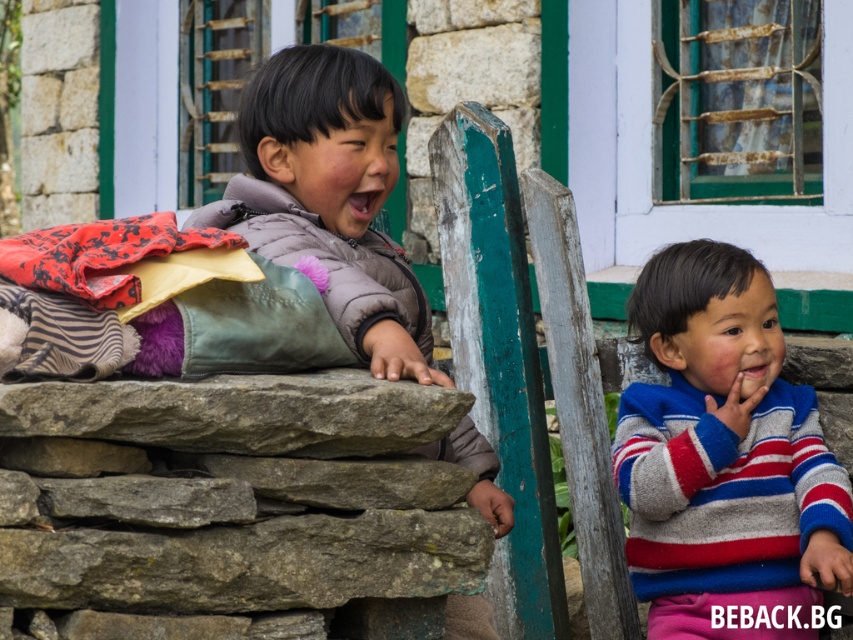
You are a photographer trying to capture a symmetrical composition. You notice the striped wool sweater at right and the matte gray jacket at center. Which object should you move to the left to balance the image?

To balance the image, you should move the striped wool sweater at right to the left side of the matte gray jacket at center, as it is currently positioned on the right side of it.

You are a photographer trying to capture both the striped wool sweater at right and the matte gray jacket at center in a single frame. Based on their positions, which object should you focus on first to ensure both are in focus?

The striped wool sweater at right is in front of the matte gray jacket at center, so you should focus on the striped wool sweater at right first to ensure both are in focus.